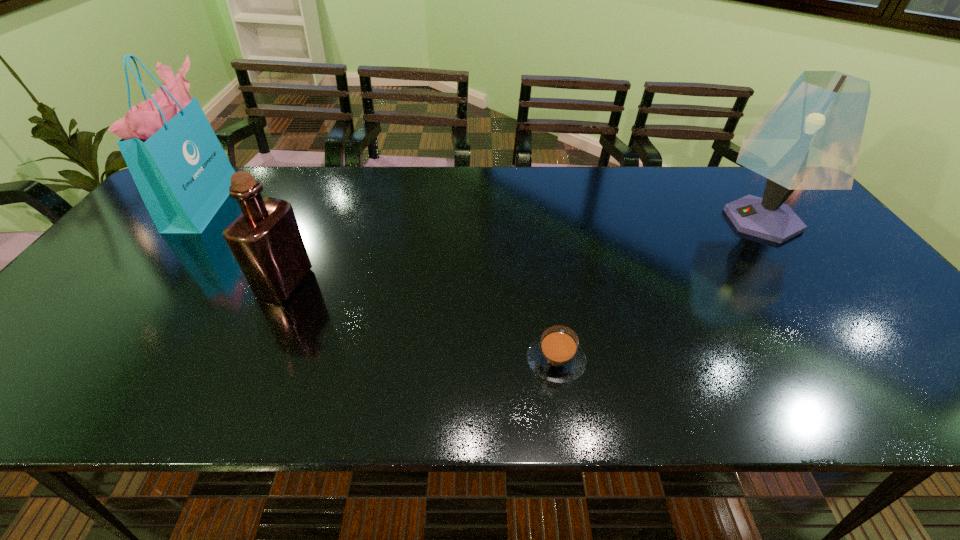
You are a GUI agent. You are given a task and a screenshot of the screen. Output one action in this format:
    pyautogui.click(x=<x>, y=<y>)
    Task: Click on the blank space at the near edge
    
    Given the screenshot: What is the action you would take?
    pyautogui.click(x=671, y=373)

What are the coordinates of `free space at the right edge` in the screenshot? It's located at (841, 320).

Identify the location of vacant space that is in between the cappuccino and the liquor. click(420, 321).

Where is `free space between the cappuccino and the shopping bag`? Image resolution: width=960 pixels, height=540 pixels. free space between the cappuccino and the shopping bag is located at coordinates (380, 281).

Identify the location of free space between the leftmost object and the rightmost object. This screenshot has width=960, height=540. (484, 211).

Find the location of a particular element. The height and width of the screenshot is (540, 960). free space between the shortest object and the leftmost object is located at coordinates (380, 281).

Where is `empty location between the lampshade and the leftmost object`? empty location between the lampshade and the leftmost object is located at coordinates (484, 211).

In order to click on free space between the shopping bag and the cappuccino in this screenshot , I will do `click(380, 281)`.

The image size is (960, 540). In order to click on vacant area that lies between the shortest object and the leftmost object in this screenshot , I will do `click(380, 281)`.

The width and height of the screenshot is (960, 540). In order to click on free space between the second object from right to left and the second object from left to right in this screenshot , I will do pos(420,321).